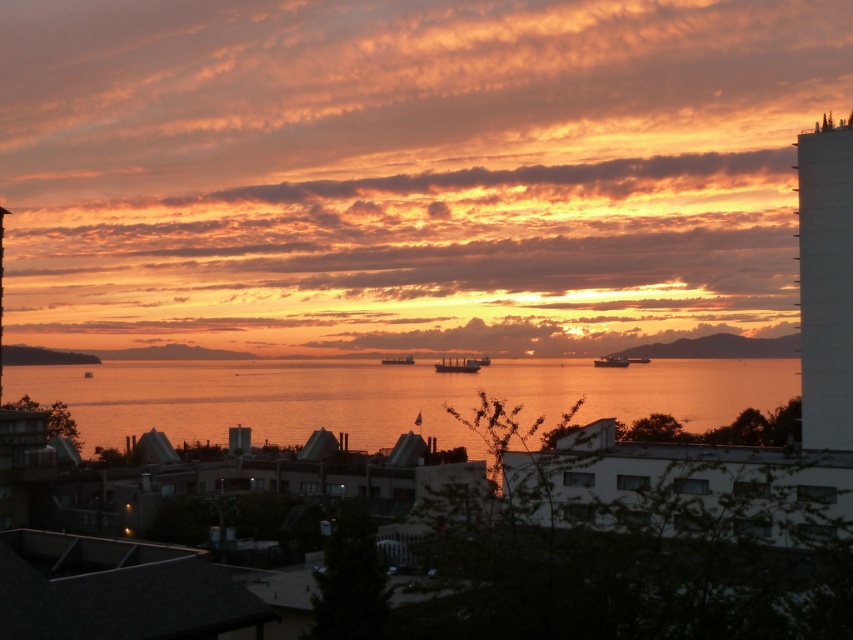
You are a photographer trying to capture the sunset. You notice the golden reflective water at center and the smooth metallic ship at center. Which object is located to the left of the other?

The golden reflective water at center is positioned on the left side of smooth metallic ship at center.

You are a drone operator planning to fly a drone between the smooth concrete tower at upper left and the nearest ship silhouette in the middle ground. The drone has a maximum flight range of 100 meters. Can the drone safely make the trip without needing to recharge?

The smooth concrete tower at upper left and the nearest ship silhouette in the middle ground are 113.53 meters apart. Since the drone can only fly 100 meters before needing to recharge, it cannot safely make the trip without recharging.